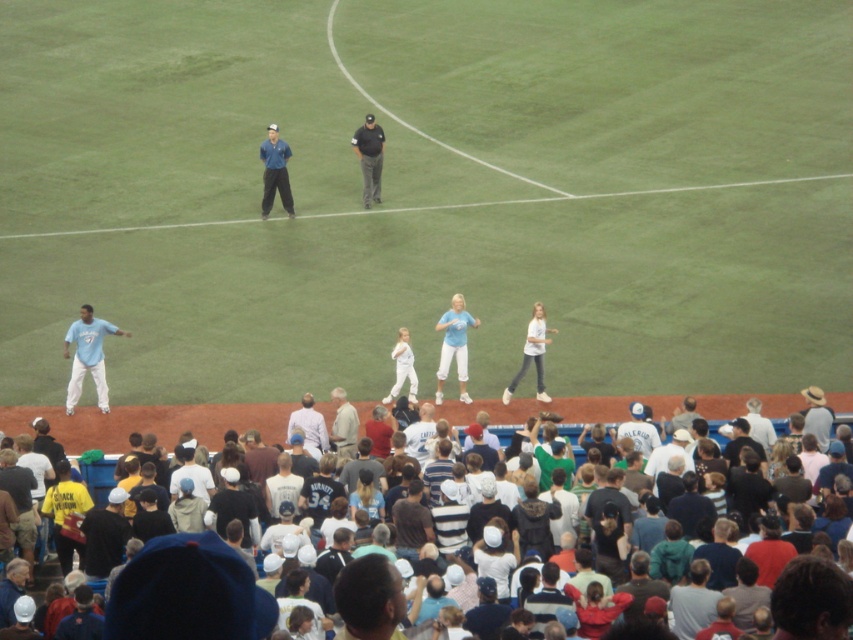
You are a photographer at the baseball stadium and need to capture a wide shot of both the light blue jersey at left and the blue fabric uniform at center. Given their sizes, which object should you focus on first to ensure both are fully in frame?

The light blue jersey at left is wider than the blue fabric uniform at center, so you should focus on the light blue jersey at left first to ensure both are fully in frame.

You are a photographer at the baseball stadium. You need to capture a photo that includes both the light blue jersey at left and the blue fabric uniform at center. Which one of the two should you focus on if you want the one that is shorter to be clearly visible in the foreground?

You should focus on the light blue jersey at left because it is shorter than the blue fabric uniform at center, making it more prominent in the foreground.